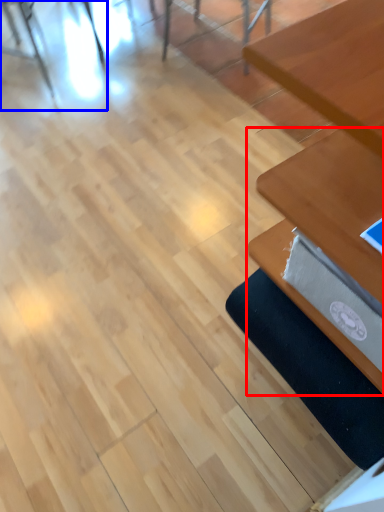
Question: Which object is further to the camera taking this photo, table (highlighted by a red box) or chair (highlighted by a blue box)?

Choices:
 (A) table
 (B) chair

Answer: (B)